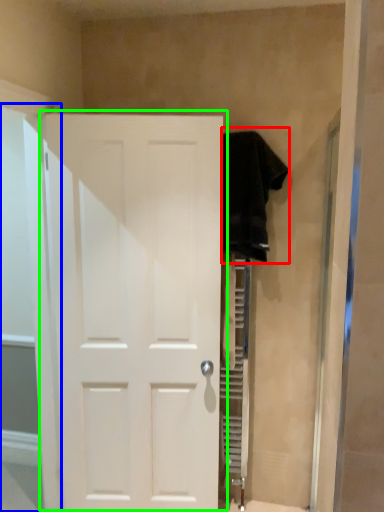
Question: Which object is positioned farthest from clothing (highlighted by a red box)? Select from glass door (highlighted by a blue box) and door (highlighted by a green box).

Choices:
 (A) glass door
 (B) door

Answer: (A)